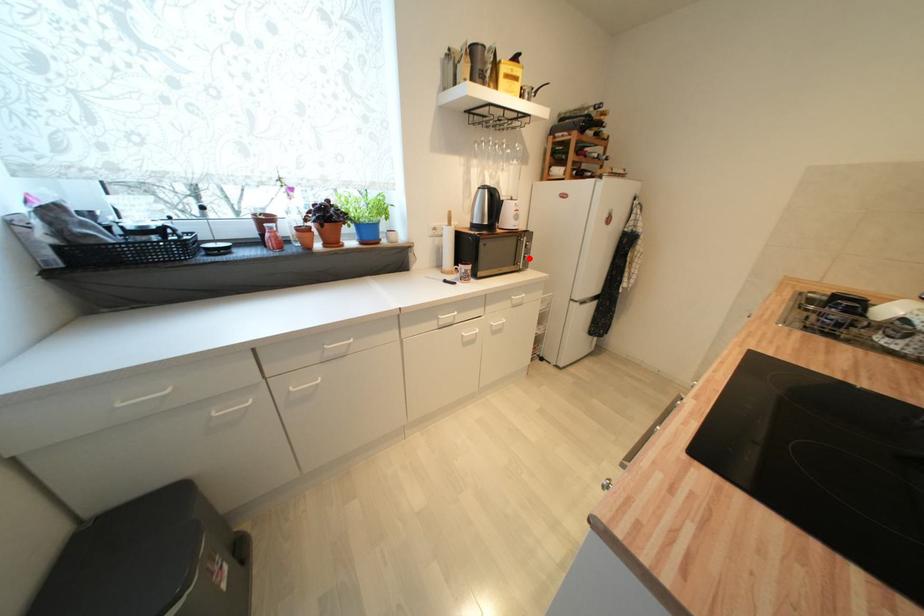
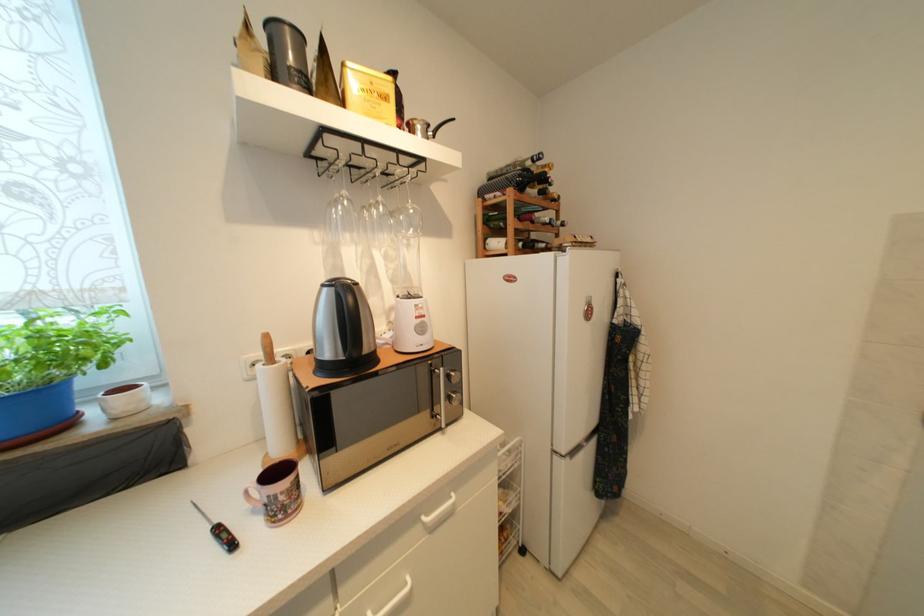
Question: I am providing you with two images of the same scene from different viewpoints. A red point is shown in image1. For the corresponding object point in image2, is it positioned nearer or farther from the camera?

Choices:
 (A) Nearer
 (B) Farther

Answer: (B)